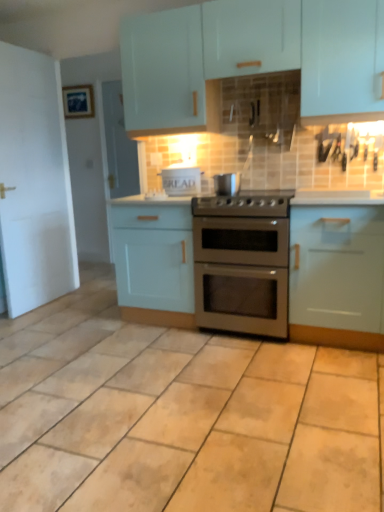
The width and height of the screenshot is (384, 512). Describe the element at coordinates (251, 58) in the screenshot. I see `matte white cabinets at upper center, placed as the 1th cabinetry when sorted from top to bottom` at that location.

You are a GUI agent. You are given a task and a screenshot of the screen. Output one action in this format:
    pyautogui.click(x=<x>, y=<y>)
    Task: Click on the satin silver pot at center, the 2th appliance when ordered from left to right
    
    Given the screenshot: What is the action you would take?
    pyautogui.click(x=227, y=184)

The width and height of the screenshot is (384, 512). What are the coordinates of `white glossy countertop at center` in the screenshot? It's located at (337, 198).

Describe the element at coordinates (337, 198) in the screenshot. I see `white glossy countertop at center` at that location.

Measure the distance between point (189,298) and camera.

The distance of point (189,298) from camera is 2.86 meters.

Find the location of a particular element. This screenshot has width=384, height=512. satin silver oven at center is located at coordinates (242, 274).

Who is taller, matte light blue cabinet at center, the 2th cabinetry viewed from the top, or satin silver oven at center?

With more height is matte light blue cabinet at center, the 2th cabinetry viewed from the top.

Is matte light blue cabinet at center, which is the second cabinetry in bottom-to-top order, positioned with its back to satin silver oven at center?

No, matte light blue cabinet at center, which is the second cabinetry in bottom-to-top order,'s orientation is not away from satin silver oven at center.

Is the surface of matte light blue cabinet at center, which is the second cabinetry in bottom-to-top order, in direct contact with satin silver oven at center?

matte light blue cabinet at center, which is the second cabinetry in bottom-to-top order, and satin silver oven at center are not in contact.

From the image's perspective, which one is positioned higher, satin silver pot at center, marked as the 1th appliance in a front-to-back arrangement, or matte white cabinets at upper center, placed as the 1th cabinetry when sorted from top to bottom?

matte white cabinets at upper center, placed as the 1th cabinetry when sorted from top to bottom.

Is satin silver pot at center, placed as the first appliance when sorted from right to left, wider than matte white cabinets at upper center, placed as the 1th cabinetry when sorted from top to bottom?

In fact, satin silver pot at center, placed as the first appliance when sorted from right to left, might be narrower than matte white cabinets at upper center, placed as the 1th cabinetry when sorted from top to bottom.

Considering the relative sizes of satin silver pot at center, marked as the 1th appliance in a front-to-back arrangement, and matte white cabinets at upper center, placed as the 1th cabinetry when sorted from top to bottom, in the image provided, is satin silver pot at center, marked as the 1th appliance in a front-to-back arrangement, bigger than matte white cabinets at upper center, placed as the 1th cabinetry when sorted from top to bottom,?

Incorrect, satin silver pot at center, marked as the 1th appliance in a front-to-back arrangement, is not larger than matte white cabinets at upper center, placed as the 1th cabinetry when sorted from top to bottom.

Is white cardboard bread box at center, which appears as the first appliance when viewed from the left, at the back of matte light blue cabinet at center, the 2th cabinetry viewed from the top?

No, matte light blue cabinet at center, the 2th cabinetry viewed from the top,'s orientation is not away from white cardboard bread box at center, which appears as the first appliance when viewed from the left.

Considering the relative positions of matte light blue cabinet at center, which is the second cabinetry in bottom-to-top order, and white cardboard bread box at center, which is counted as the 2th appliance, starting from the right, in the image provided, is matte light blue cabinet at center, which is the second cabinetry in bottom-to-top order, to the left of white cardboard bread box at center, which is counted as the 2th appliance, starting from the right, from the viewer's perspective?

Yes.

From their relative heights in the image, would you say matte light blue cabinet at center, the 2th cabinetry viewed from the top, is taller or shorter than white cardboard bread box at center, acting as the 2th appliance starting from the front?

matte light blue cabinet at center, the 2th cabinetry viewed from the top, is taller than white cardboard bread box at center, acting as the 2th appliance starting from the front.

Which object is closer to the camera, light blue matte cabinet at lower right, marked as the first cabinetry in a bottom-to-top arrangement, or matte light blue cabinet at center, the 2th cabinetry viewed from the top?

light blue matte cabinet at lower right, marked as the first cabinetry in a bottom-to-top arrangement, is more forward.

Which is closer, [368,298] or [175,264]?

Clearly, point [368,298] is closer to the camera than point [175,264].

Is light blue matte cabinet at lower right, positioned as the third cabinetry in top-to-bottom order, bigger than matte light blue cabinet at center, which is the second cabinetry in bottom-to-top order?

No, light blue matte cabinet at lower right, positioned as the third cabinetry in top-to-bottom order, is not bigger than matte light blue cabinet at center, which is the second cabinetry in bottom-to-top order.

Between light blue matte cabinet at lower right, positioned as the third cabinetry in top-to-bottom order, and matte light blue cabinet at center, which is the second cabinetry in bottom-to-top order, which one has less height?

matte light blue cabinet at center, which is the second cabinetry in bottom-to-top order.

Does matte white cabinets at upper center, placed as the 1th cabinetry when sorted from top to bottom, have a lesser height compared to matte blue picture frame at upper left?

No, matte white cabinets at upper center, placed as the 1th cabinetry when sorted from top to bottom, is not shorter than matte blue picture frame at upper left.

Choose the correct answer: Is matte white cabinets at upper center, placed as the third cabinetry when sorted from bottom to top, inside matte blue picture frame at upper left or outside it?

matte white cabinets at upper center, placed as the third cabinetry when sorted from bottom to top, is not enclosed by matte blue picture frame at upper left.

From the image's perspective, relative to matte blue picture frame at upper left, is matte white cabinets at upper center, placed as the third cabinetry when sorted from bottom to top, above or below?

matte white cabinets at upper center, placed as the third cabinetry when sorted from bottom to top, is below matte blue picture frame at upper left.

Considering the positions of points (270, 205) and (321, 203), is point (270, 205) farther from camera compared to point (321, 203)?

Yes, it is.

Is stainless steel gas stove at center wider or thinner than white glossy countertop at center?

In the image, stainless steel gas stove at center appears to be wider than white glossy countertop at center.

Is stainless steel gas stove at center behind white glossy countertop at center?

Yes, stainless steel gas stove at center is behind white glossy countertop at center.

Measure the distance between matte white cabinets at upper center, placed as the 1th cabinetry when sorted from top to bottom, and light blue matte cabinet at lower right, marked as the first cabinetry in a bottom-to-top arrangement.

They are 3.33 feet apart.

Is matte white cabinets at upper center, placed as the 1th cabinetry when sorted from top to bottom, aimed at light blue matte cabinet at lower right, marked as the first cabinetry in a bottom-to-top arrangement?

No.

Is light blue matte cabinet at lower right, marked as the first cabinetry in a bottom-to-top arrangement, inside matte white cabinets at upper center, placed as the 1th cabinetry when sorted from top to bottom?

That's incorrect, light blue matte cabinet at lower right, marked as the first cabinetry in a bottom-to-top arrangement, is not inside matte white cabinets at upper center, placed as the 1th cabinetry when sorted from top to bottom.

The height and width of the screenshot is (512, 384). What are the coordinates of `oven below the matte light blue cabinet at center, the 2th cabinetry viewed from the top (from a real-world perspective)` in the screenshot? It's located at (242, 274).

From the matte white cabinets at upper center, placed as the third cabinetry when sorted from bottom to top, count the 1st appliance to the left and point to it. Please provide its 2D coordinates.

[(227, 184)]

Estimate the real-world distances between objects in this image. Which object is closer to matte white cabinets at upper center, placed as the third cabinetry when sorted from bottom to top, matte light blue cabinet at center, the 2th cabinetry viewed from the top, or light blue matte cabinet at lower right, marked as the first cabinetry in a bottom-to-top arrangement?

matte light blue cabinet at center, the 2th cabinetry viewed from the top, is positioned closer to the anchor matte white cabinets at upper center, placed as the third cabinetry when sorted from bottom to top.

Based on their spatial positions, is satin silver pot at center, which is the second appliance in back-to-front order, or satin silver oven at center closer to white cardboard bread box at center, which appears as the first appliance when viewed from the left?

satin silver pot at center, which is the second appliance in back-to-front order.

From the image, which object appears to be nearer to white glossy countertop at center, stainless steel gas stove at center or matte light blue cabinet at center, the 2th cabinetry viewed from the top?

The object closer to white glossy countertop at center is stainless steel gas stove at center.

Which object lies further to the anchor point satin silver pot at center, marked as the 1th appliance in a front-to-back arrangement, satin silver oven at center or white cardboard bread box at center, which ranks as the first appliance in back-to-front order?

satin silver oven at center.

Considering their positions, is light blue matte cabinet at lower right, positioned as the third cabinetry in top-to-bottom order, positioned closer to matte blue picture frame at upper left than stainless steel gas stove at center?

Based on the image, stainless steel gas stove at center appears to be nearer to matte blue picture frame at upper left.

When comparing their distances from matte white cabinets at upper center, placed as the 1th cabinetry when sorted from top to bottom, does satin silver oven at center or white glossy countertop at center seem further?

Among the two, satin silver oven at center is located further to matte white cabinets at upper center, placed as the 1th cabinetry when sorted from top to bottom.

Estimate the real-world distances between objects in this image. Which object is closer to matte light blue cabinet at center, the 2th cabinetry viewed from the top, light blue matte cabinet at lower right, marked as the first cabinetry in a bottom-to-top arrangement, or satin silver pot at center, placed as the first appliance when sorted from right to left?

Based on the image, satin silver pot at center, placed as the first appliance when sorted from right to left, appears to be nearer to matte light blue cabinet at center, the 2th cabinetry viewed from the top.

Estimate the real-world distances between objects in this image. Which object is further from matte white cabinets at upper center, placed as the third cabinetry when sorted from bottom to top, stainless steel gas stove at center or satin silver oven at center?

The object further to matte white cabinets at upper center, placed as the third cabinetry when sorted from bottom to top, is satin silver oven at center.

Where is `oven between white cardboard bread box at center, which ranks as the first appliance in back-to-front order, and white glossy countertop at center, in the horizontal direction`? Image resolution: width=384 pixels, height=512 pixels. oven between white cardboard bread box at center, which ranks as the first appliance in back-to-front order, and white glossy countertop at center, in the horizontal direction is located at coordinates (242, 274).

The image size is (384, 512). What are the coordinates of `counter top between satin silver oven at center and light blue matte cabinet at lower right, positioned as the third cabinetry in top-to-bottom order, from left to right` in the screenshot? It's located at (337, 198).

Image resolution: width=384 pixels, height=512 pixels. What are the coordinates of `appliance between white cardboard bread box at center, which appears as the first appliance when viewed from the left, and satin silver oven at center, in the vertical direction` in the screenshot? It's located at (227, 184).

Identify the location of gas stove between white cardboard bread box at center, which appears as the first appliance when viewed from the left, and satin silver oven at center from top to bottom. This screenshot has height=512, width=384. (245, 203).